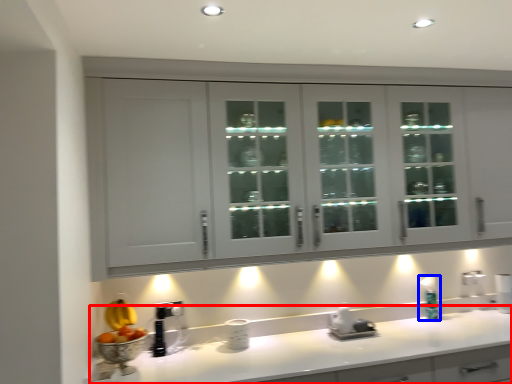
Question: Which of the following is the farthest to the observer, countertop (highlighted by a red box) or soap dispenser (highlighted by a blue box)?

Choices:
 (A) countertop
 (B) soap dispenser

Answer: (B)